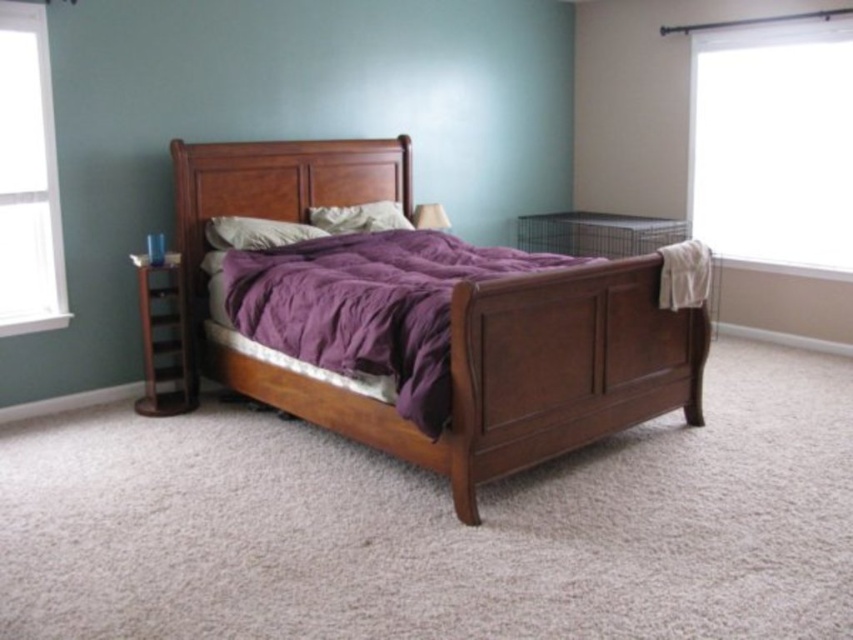
Question: Which object is closer to the camera taking this photo?

Choices:
 (A) soft white pillow at center
 (B) white sheer curtain at upper right
 (C) purple cotton blanket at center

Answer: (C)

Question: Is white sheer curtain at upper right below purple cotton blanket at center?

Choices:
 (A) yes
 (B) no

Answer: (B)

Question: Which point appears closest to the camera in this image?

Choices:
 (A) (334, 241)
 (B) (209, 172)
 (C) (310, 221)
 (D) (538, 388)

Answer: (D)

Question: Can you confirm if white glass window at left is positioned to the left of matte purple pillow at upper center?

Choices:
 (A) yes
 (B) no

Answer: (A)

Question: Is wooden headboard at center wider than white glass window at left?

Choices:
 (A) yes
 (B) no

Answer: (A)

Question: Estimate the real-world distances between objects in this image. Which object is closer to the white sheer curtain at upper right?

Choices:
 (A) wooden headboard at center
 (B) purple cotton blanket at center
 (C) matte wood bed at center

Answer: (C)